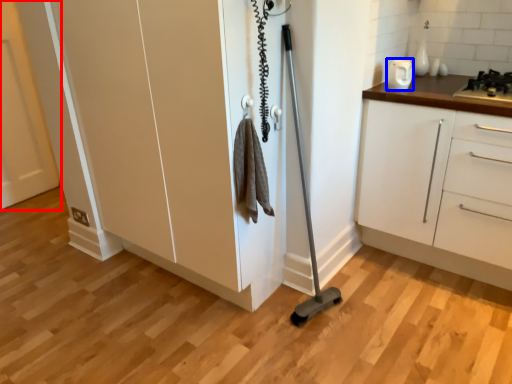
Question: Among these objects, which one is farthest to the camera, door (highlighted by a red box) or appliance (highlighted by a blue box)?

Choices:
 (A) door
 (B) appliance

Answer: (A)